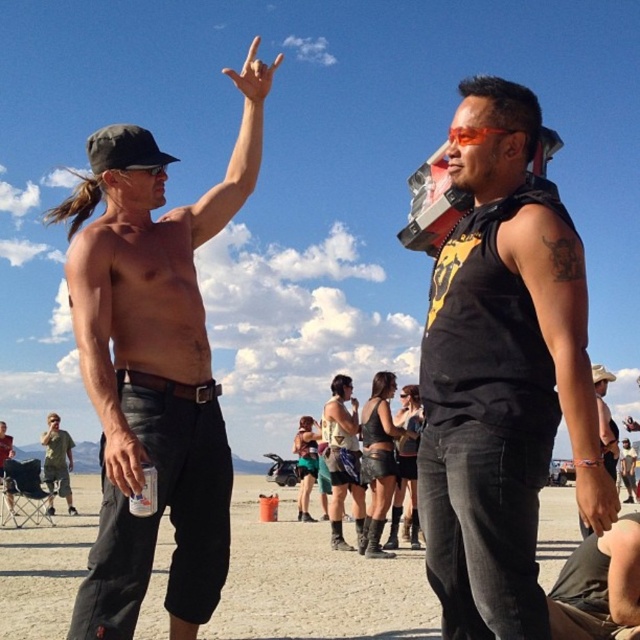
You are a GUI agent. You are given a task and a screenshot of the screen. Output one action in this format:
    pyautogui.click(x=<x>, y=<y>)
    Task: Click on the black fabric pants at lower center
    The width and height of the screenshot is (640, 640).
    Given the screenshot: What is the action you would take?
    pyautogui.click(x=314, y=580)

Does black fabric pants at lower center have a lesser height compared to matte black tank top at center?

Yes.

What are the coordinates of `black fabric pants at lower center` in the screenshot? It's located at (314, 580).

Does matte plastic cup at lower left come behind matte black hand at lower right?

Yes, matte plastic cup at lower left is further from the viewer.

Is matte plastic cup at lower left thinner than matte black hand at lower right?

Yes, matte plastic cup at lower left is thinner than matte black hand at lower right.

Is point (140, 458) positioned in front of point (586, 532)?

Yes, point (140, 458) is in front of point (586, 532).

You are a GUI agent. You are given a task and a screenshot of the screen. Output one action in this format:
    pyautogui.click(x=<x>, y=<y>)
    Task: Click on the matte plastic cup at lower left
    Image resolution: width=640 pixels, height=640 pixels.
    Given the screenshot: What is the action you would take?
    pyautogui.click(x=124, y=460)

Is black fabric pants at lower center thinner than denim shorts at lower right?

In fact, black fabric pants at lower center might be wider than denim shorts at lower right.

How far apart are black fabric pants at lower center and denim shorts at lower right?

They are 6.64 meters apart.

What do you see at coordinates (314, 580) in the screenshot? This screenshot has height=640, width=640. I see `black fabric pants at lower center` at bounding box center [314, 580].

The height and width of the screenshot is (640, 640). In order to click on black fabric pants at lower center in this screenshot , I will do `click(314, 580)`.